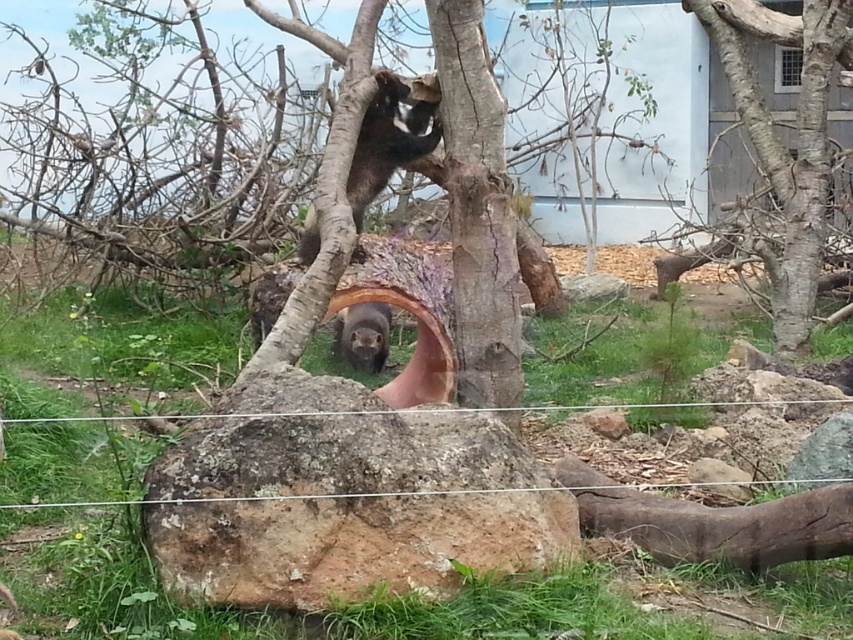
You are observing an animal enclosure and see two points marked in the image. The first point is at coordinate point(805, 38) and the second point is at point(354, 333). Which point is closer to you, the observer?

Point(805, 38) is in front of point(354, 333), so it is closer to you.

You are a zookeeper preparing to feed the animals. You notice the wire mesh at center and the smooth bark tree trunk at center in the enclosure. Which object would block your view of the animal behind it more effectively?

The wire mesh at center has a larger size compared to the smooth bark tree trunk at center, so it would block your view more effectively.